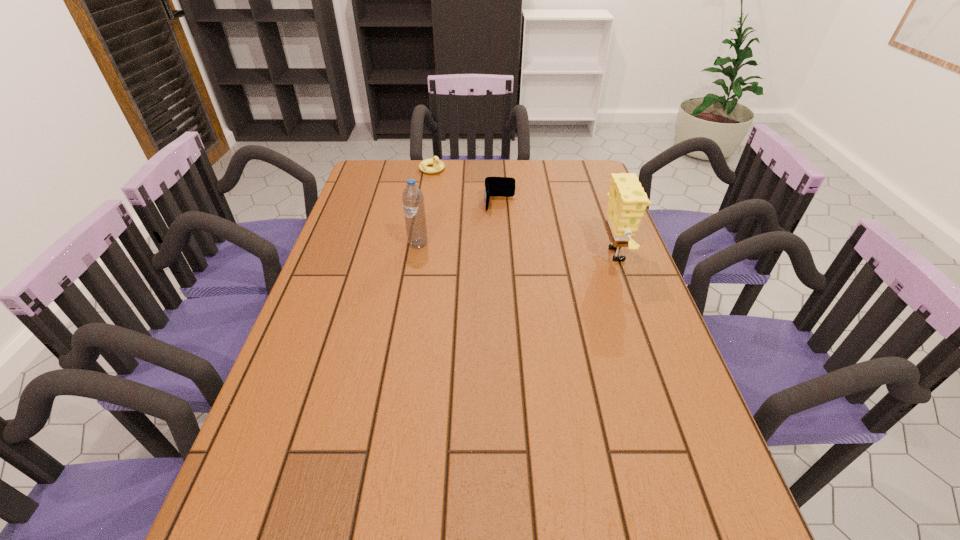
At what (x,y) coordinates should I click in order to perform the action: click on vacant area between the water bottle and the third object from left to right. Please return your answer as a coordinate pair (x, y). The width and height of the screenshot is (960, 540). Looking at the image, I should click on (459, 224).

Where is `object that stands as the closest to the rightmost object`? Image resolution: width=960 pixels, height=540 pixels. object that stands as the closest to the rightmost object is located at coordinates (494, 186).

I want to click on the third closest object relative to the water bottle, so click(627, 201).

At what (x,y) coordinates should I click in order to perform the action: click on blank space that satisfies the following two spatial constraints: 1. on the front side of the water bottle; 2. on the front-facing side of the sponge. Please return your answer as a coordinate pair (x, y). This screenshot has height=540, width=960. Looking at the image, I should click on (417, 254).